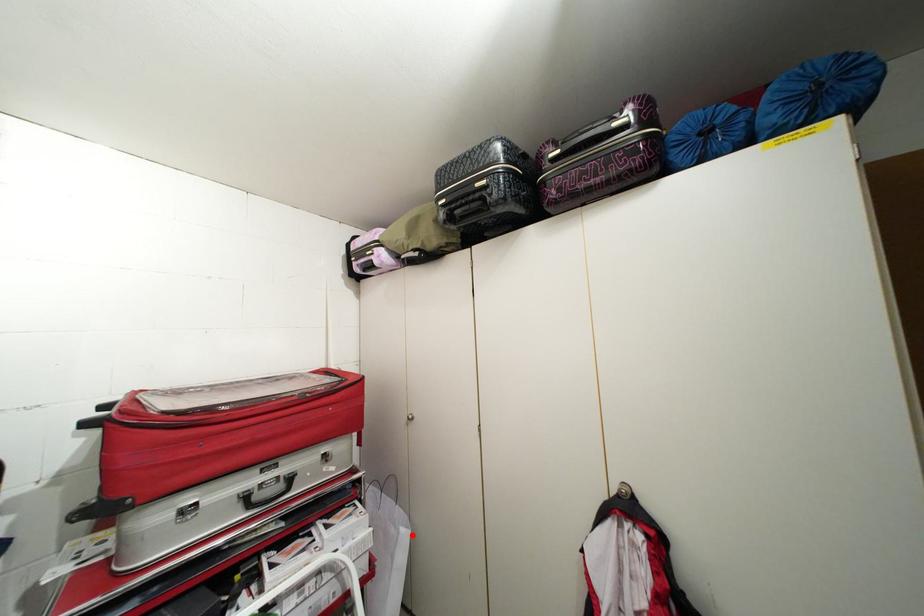
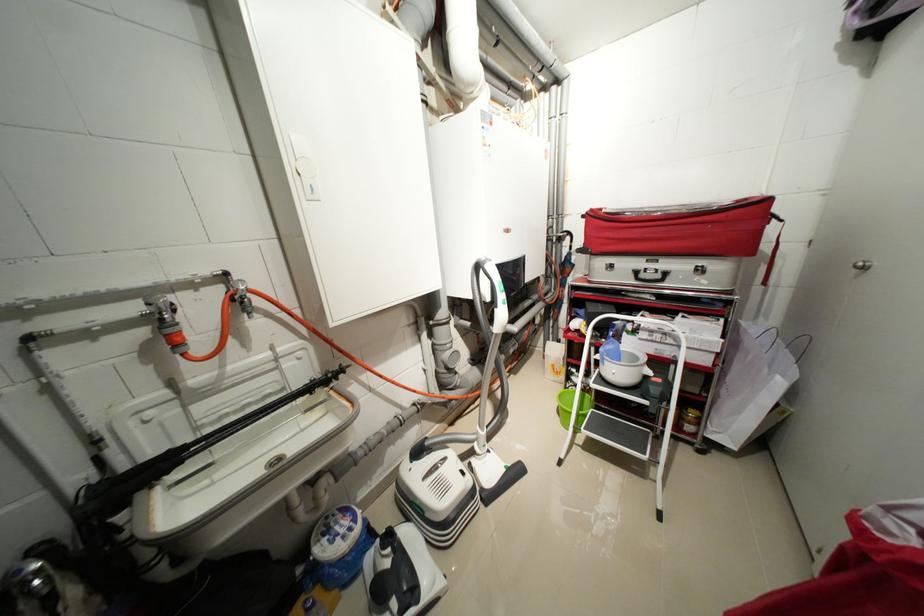
Question: I am providing you with two images of the same scene from different viewpoints. A red point is marked on the first image. At the location where the point appears in image 1, is it still visible in image 2?

Choices:
 (A) Yes
 (B) No

Answer: (A)